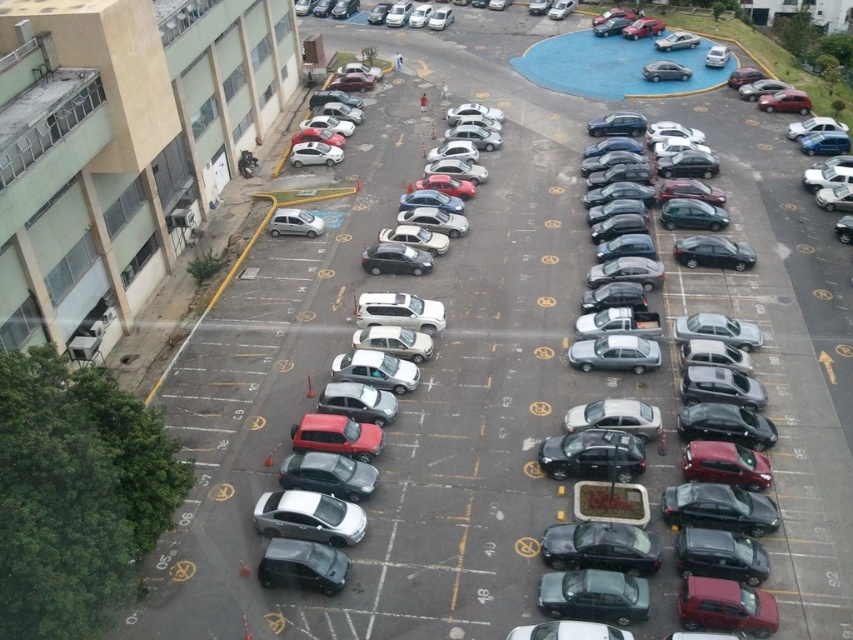
You are a delivery driver who needs to park your van in the parking lot. You see a matte gray car at left and a satin silver sedan at upper center. Which parking space is closer to the entrance of the building on the left side?

The matte gray car at left is located below the satin silver sedan at upper center, so the matte gray car at left is closer to the entrance of the building on the left side.

You are standing at the edge of the parking lot near the multi story building on the left. You see two points marked in the parking lot, point (322, 124) and point (682, 42). Which point is closer to you?

Point (322, 124) is closer to the viewer than point (682, 42).

You are a delivery driver who needs to park your truck, which is 2 meters tall, in this parking lot. There are two cars present. The matte gray car at left and the satin silver sedan at upper center. Which car should you avoid parking next to to ensure your truck doesn

The matte gray car at left is taller than the satin silver sedan at upper center. Therefore, you should avoid parking next to the matte gray car at left because it is taller and may obstruct the truck